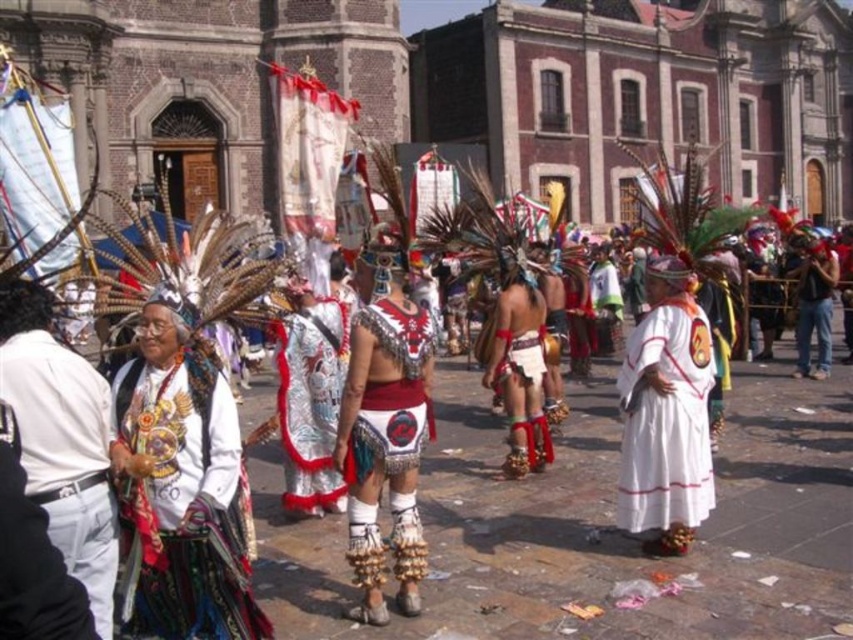
You are an event organizer at the cultural festival. You need to place a protective cover over the white cotton shirt at center and the silver metallic armor at center. Which object requires a larger cover?

The white cotton shirt at center requires a larger cover because it is bigger than the silver metallic armor at center.

You are attending this cultural event and want to take a photo of both the embroidered velvet dress at center and the white cotton shirt at center. Which one should you focus on first if you want to capture them from left to right?

You should focus on the white cotton shirt at center first since it is on the left side of the embroidered velvet dress at center.

You are a photographer at the event and want to capture both the white cotton shirt at center and the white cotton dress at center in a single frame. Which clothing item should you focus on to ensure both fit in the frame without cropping?

The white cotton shirt at center is wider than the white cotton dress at center. To ensure both fit in the frame without cropping, focus on the white cotton shirt at center as it is wider, allowing the dress to be captured alongside it.